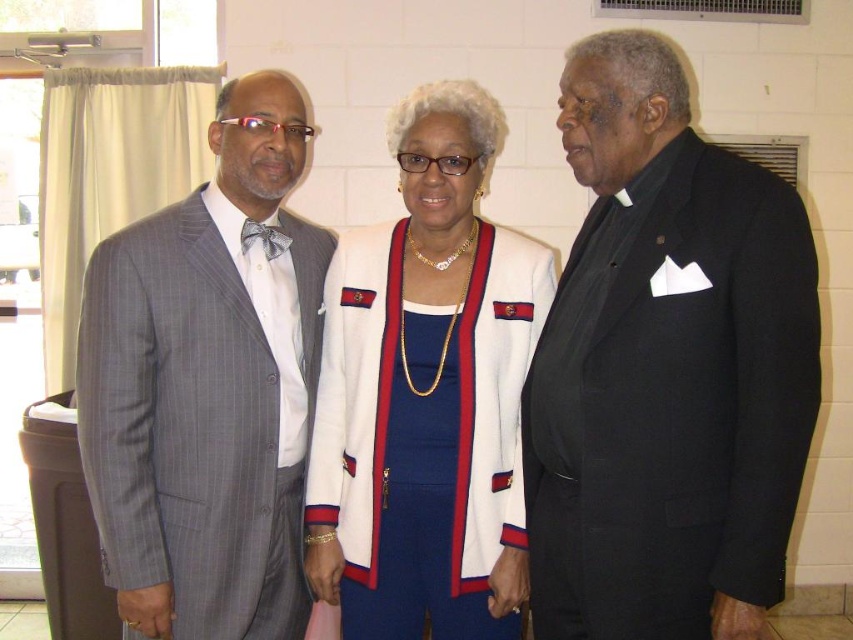
You are at a formal event and need to find the black satin suit at right. From the perspective of the gray pinstripe suit at left, which direction should you look to locate it?

The black satin suit at right is located above the gray pinstripe suit at left, so from the perspective of the gray pinstripe suit at left, you should look upward to locate it.

You are a photographer setting up for a group photo. You need to arrange the black satin suit at right and the gray pinstripe suit at left so that they are both visible in the frame. Based on their current positions, which side should you position yourself to capture both individuals without any overlap?

You should position yourself to the left side of the gray pinstripe suit at left since the black satin suit at right is on the right side of the gray pinstripe suit at left, allowing both to be visible in the frame without overlapping.

Based on the scene description, where is the gray pinstripe suit at left located in the image?

The gray pinstripe suit at left is located at the 2D coordinates point [207,385] in the image.